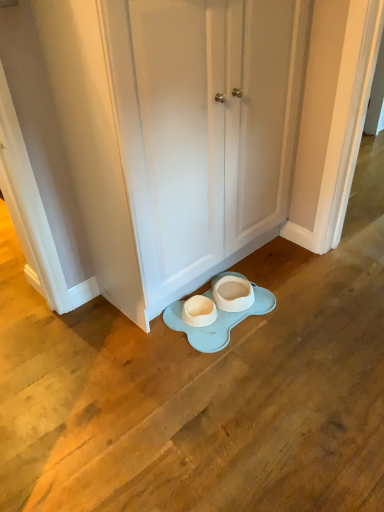
At what (x,y) coordinates should I click in order to perform the action: click on blank space situated above white matte porcelain at center (from a real-world perspective). Please return your answer as a coordinate pair (x, y). The height and width of the screenshot is (512, 384). Looking at the image, I should click on (228, 310).